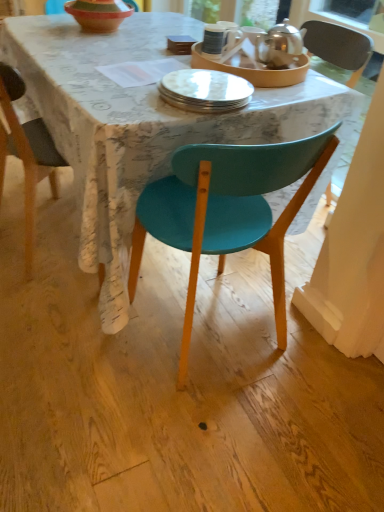
Locate an element on the screen. The width and height of the screenshot is (384, 512). free area behind teal plastic chair at center is located at coordinates (209, 270).